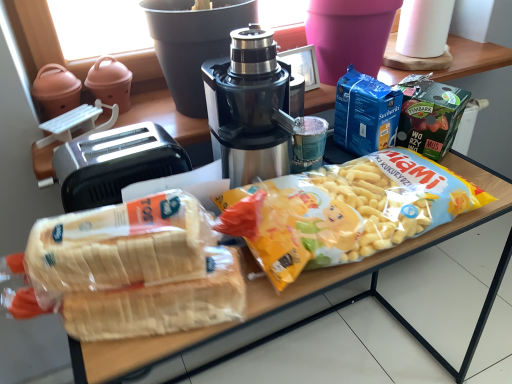
Question: Does translucent plastic bread at lower left appear on the left side of stainless steel coffee maker at center?

Choices:
 (A) no
 (B) yes

Answer: (B)

Question: Can we say translucent plastic bread at lower left lies outside stainless steel coffee maker at center?

Choices:
 (A) yes
 (B) no

Answer: (A)

Question: Is the position of translucent plastic bread at lower left more distant than that of stainless steel coffee maker at center?

Choices:
 (A) no
 (B) yes

Answer: (A)

Question: From the image's perspective, is translucent plastic bread at lower left under stainless steel coffee maker at center?

Choices:
 (A) yes
 (B) no

Answer: (A)

Question: Is translucent plastic bread at lower left turned away from stainless steel coffee maker at center?

Choices:
 (A) yes
 (B) no

Answer: (A)

Question: Considering the relative sizes of translucent plastic bread at lower left and stainless steel coffee maker at center in the image provided, is translucent plastic bread at lower left shorter than stainless steel coffee maker at center?

Choices:
 (A) no
 (B) yes

Answer: (B)

Question: Does translucent plastic bag of bread at center touch translucent plastic bread at lower left?

Choices:
 (A) yes
 (B) no

Answer: (B)

Question: Is translucent plastic bag of bread at center oriented away from translucent plastic bread at lower left?

Choices:
 (A) no
 (B) yes

Answer: (A)

Question: Is translucent plastic bag of bread at center taller than translucent plastic bread at lower left?

Choices:
 (A) no
 (B) yes

Answer: (B)

Question: Is translucent plastic bag of bread at center smaller than translucent plastic bread at lower left?

Choices:
 (A) yes
 (B) no

Answer: (B)

Question: Is translucent plastic bag of bread at center behind translucent plastic bread at lower left?

Choices:
 (A) no
 (B) yes

Answer: (B)

Question: Can you confirm if translucent plastic bag of bread at center is wider than translucent plastic bread at lower left?

Choices:
 (A) yes
 (B) no

Answer: (A)

Question: From the image's perspective, is stainless steel coffee maker at center beneath translucent plastic bread at lower left?

Choices:
 (A) yes
 (B) no

Answer: (B)